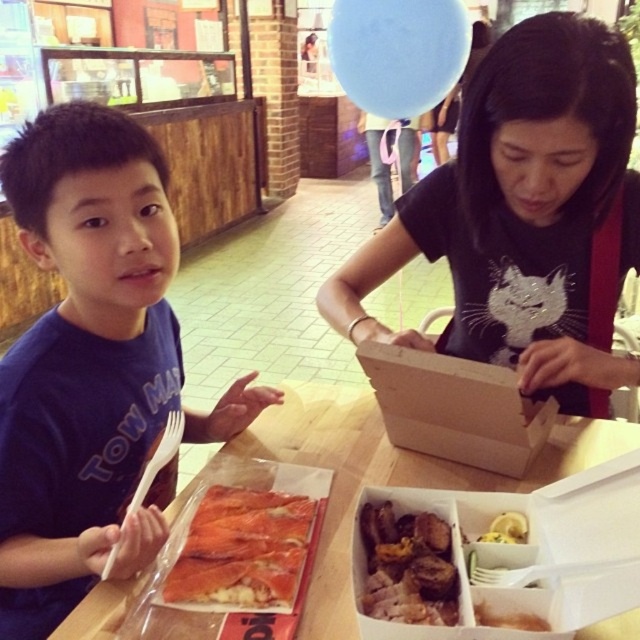
Can you confirm if blue matte shirt at left is positioned above wooden table at center?

Yes, blue matte shirt at left is above wooden table at center.

Is blue matte shirt at left positioned behind wooden table at center?

No, blue matte shirt at left is closer to the viewer.

The image size is (640, 640). In order to click on blue matte shirt at left in this screenshot , I will do `click(83, 353)`.

Consider the image. Can you confirm if wooden table at center is shorter than brown crispy meat at center?

In fact, wooden table at center may be taller than brown crispy meat at center.

Image resolution: width=640 pixels, height=640 pixels. Find the location of `wooden table at center`. wooden table at center is located at coordinates (381, 474).

Is point (544, 458) positioned after point (422, 566)?

Yes, point (544, 458) is farther from viewer.

Where is `wooden table at center`? The image size is (640, 640). wooden table at center is located at coordinates (381, 474).

Between white cardboard box at lower center and wooden table at center, which one is positioned lower?

Positioned lower is white cardboard box at lower center.

Which of these two, white cardboard box at lower center or wooden table at center, stands shorter?

Standing shorter between the two is white cardboard box at lower center.

Who is more distant from viewer, (460, 604) or (294, 442)?

Positioned behind is point (294, 442).

Identify the location of white cardboard box at lower center. (529, 552).